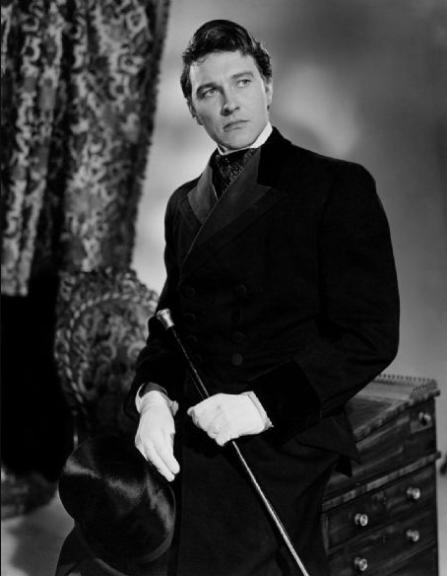
You are a GUI agent. You are given a task and a screenshot of the screen. Output one action in this format:
    pyautogui.click(x=<x>, y=<y>)
    Task: Click on the dresser
    This screenshot has height=576, width=447.
    Given the screenshot: What is the action you would take?
    pyautogui.click(x=393, y=448)